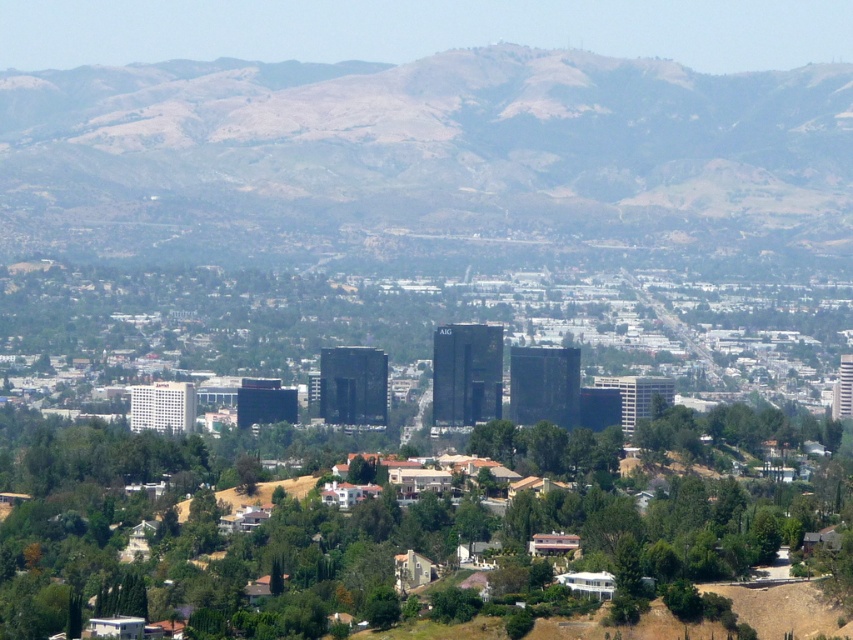
Who is positioned more to the left, brown/dry soil at center or green leafy tree at center?

green leafy tree at center

Is brown/dry soil at center taller than green leafy tree at center?

In fact, brown/dry soil at center may be shorter than green leafy tree at center.

At what (x,y) coordinates should I click in order to perform the action: click on brown/dry soil at center. Please return your answer as a coordinate pair (x, y). Looking at the image, I should click on (422, 156).

What are the coordinates of `brown/dry soil at center` in the screenshot? It's located at pos(422,156).